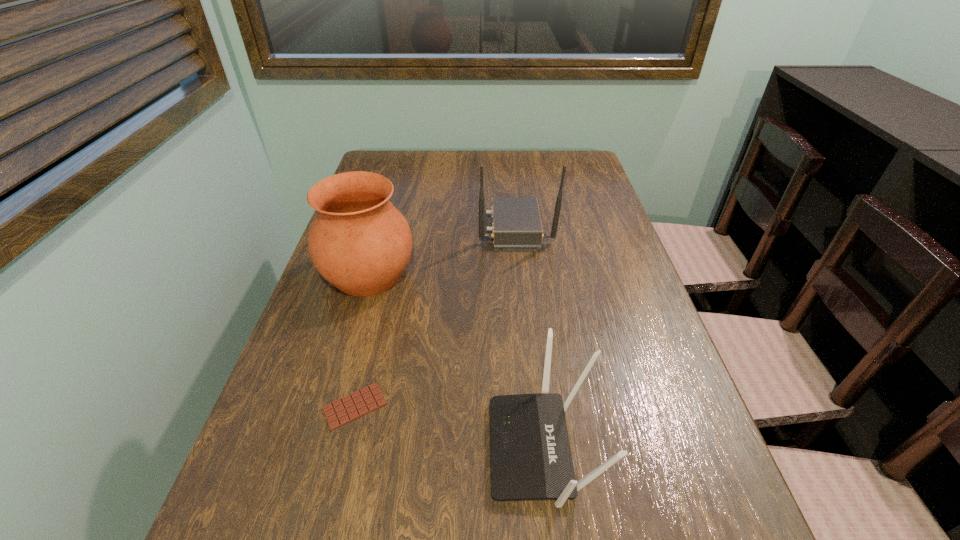
Locate an element on the screen. This screenshot has width=960, height=540. free spot between the pottery and the nearer router is located at coordinates (456, 362).

You are a GUI agent. You are given a task and a screenshot of the screen. Output one action in this format:
    pyautogui.click(x=<x>, y=<y>)
    Task: Click on the vacant point located between the candy bar and the pottery
    The width and height of the screenshot is (960, 540).
    Given the screenshot: What is the action you would take?
    pyautogui.click(x=362, y=341)

Locate an element on the screen. The image size is (960, 540). free space that is in between the farther router and the pottery is located at coordinates (442, 252).

Find the location of a particular element. free spot between the nearer router and the pottery is located at coordinates (456, 362).

At what (x,y) coordinates should I click in order to perform the action: click on free area in between the taller router and the shortest object. Please return your answer as a coordinate pair (x, y). The width and height of the screenshot is (960, 540). Looking at the image, I should click on (435, 318).

Identify the location of free space between the candy bar and the pottery. (362, 341).

The image size is (960, 540). I want to click on vacant region between the farther router and the second shortest object, so click(529, 338).

What are the coordinates of `vacant space that is in between the shortest object and the farther router` in the screenshot? It's located at (435, 318).

Where is `vacant area between the pottery and the farther router`? The image size is (960, 540). vacant area between the pottery and the farther router is located at coordinates (442, 252).

Identify which object is the second nearest to the nearer router. Please provide its 2D coordinates. Your answer should be formatted as a tuple, i.e. [(x, y)], where the tuple contains the x and y coordinates of a point satisfying the conditions above.

[(359, 242)]